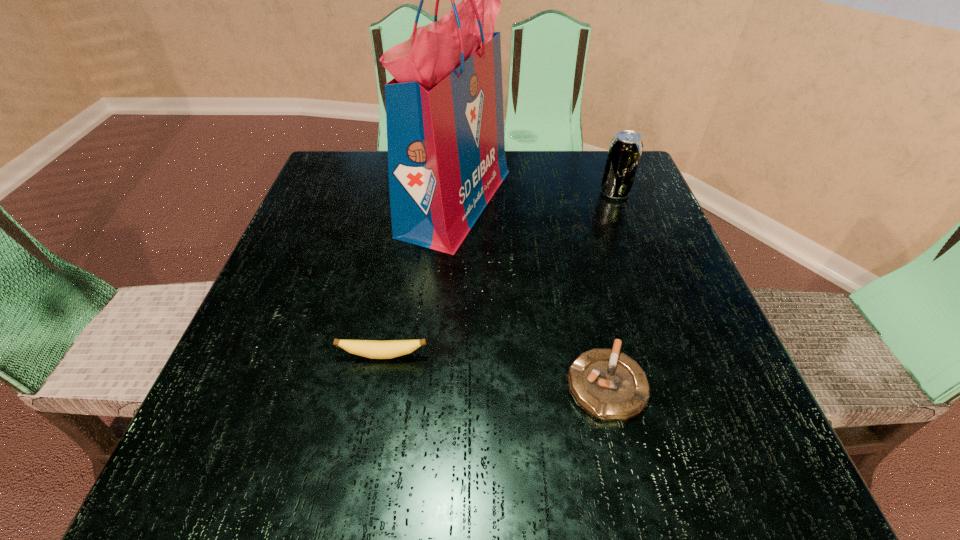
You are a GUI agent. You are given a task and a screenshot of the screen. Output one action in this format:
    pyautogui.click(x=<x>, y=<y>)
    Task: Click on the grocery bag situated at the far edge
    
    Given the screenshot: What is the action you would take?
    pyautogui.click(x=444, y=108)

Where is `soda can that is at the far edge`? Image resolution: width=960 pixels, height=540 pixels. soda can that is at the far edge is located at coordinates (625, 149).

Identify the location of object present at the left edge. (374, 349).

Identify the location of soda can that is at the right edge. click(x=625, y=149).

I want to click on ashtray located at the right edge, so click(x=610, y=386).

Where is `object that is at the far right corner`? object that is at the far right corner is located at coordinates (625, 149).

You are a GUI agent. You are given a task and a screenshot of the screen. Output one action in this format:
    pyautogui.click(x=<x>, y=<y>)
    Task: Click on the vacant space at the far edge of the desktop
    This screenshot has height=540, width=960.
    Given the screenshot: What is the action you would take?
    pyautogui.click(x=562, y=178)

At what (x,y) coordinates should I click in order to perform the action: click on vacant point at the near edge. Please return your answer as a coordinate pair (x, y). The image size is (960, 540). Looking at the image, I should click on (440, 455).

Find the location of `free space at the left edge`. free space at the left edge is located at coordinates (337, 278).

You are a GUI agent. You are given a task and a screenshot of the screen. Output one action in this format:
    pyautogui.click(x=<x>, y=<y>)
    Task: Click on the free location at the right edge
    This screenshot has height=540, width=960.
    Given the screenshot: What is the action you would take?
    pyautogui.click(x=630, y=332)